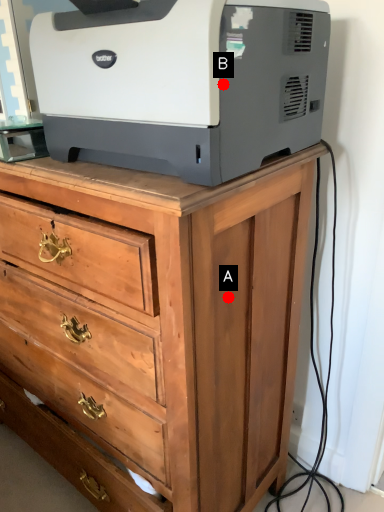
Question: Two points are circled on the image, labeled by A and B beside each circle. Which point is further to the camera?

Choices:
 (A) A is further
 (B) B is further

Answer: (A)